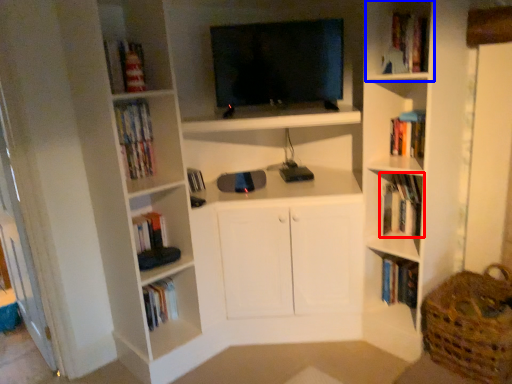
Question: Which object appears closest to the camera in this image, book (highlighted by a red box) or cabinet (highlighted by a blue box)?

Choices:
 (A) book
 (B) cabinet

Answer: (B)